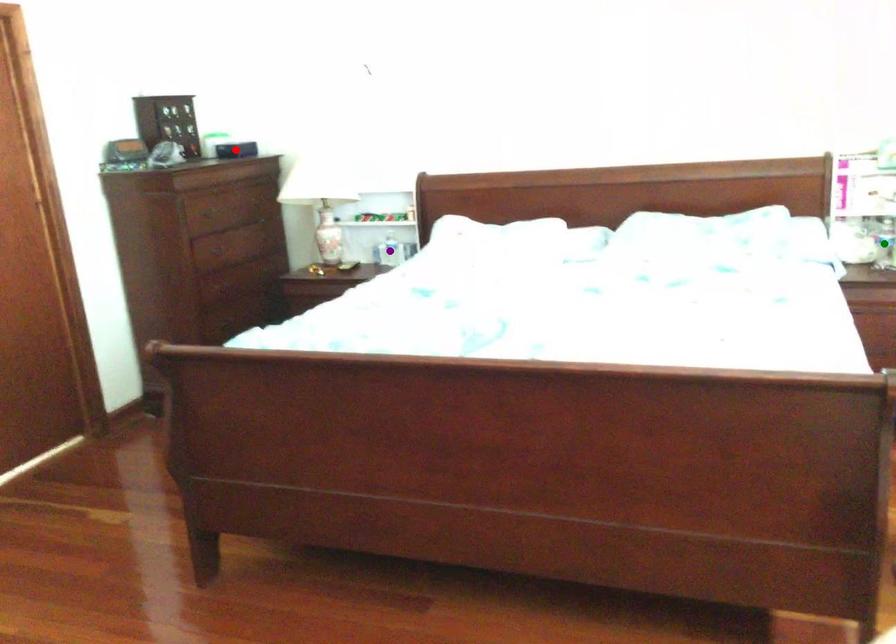
Order these from nearest to farthest:
1. purple point
2. red point
3. green point

purple point, red point, green point